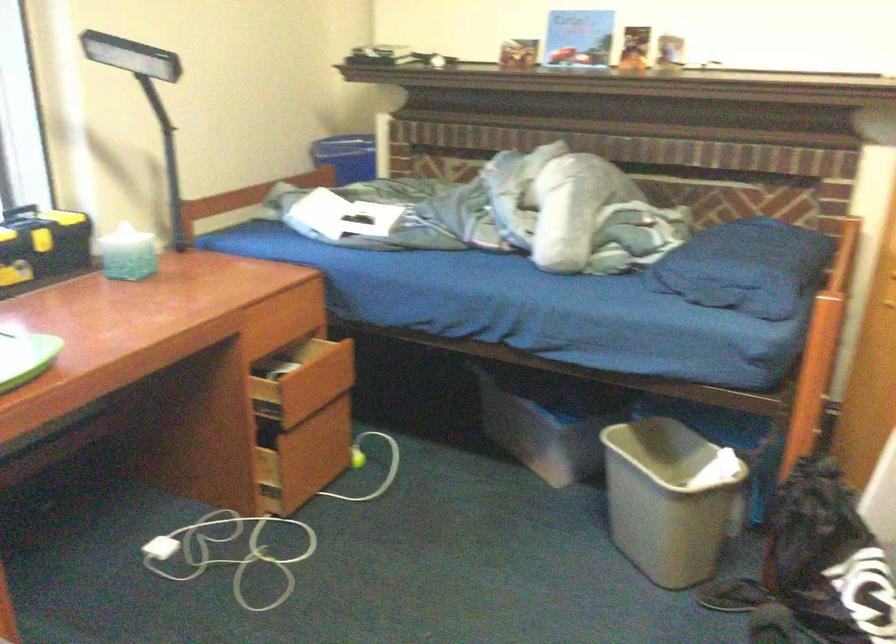
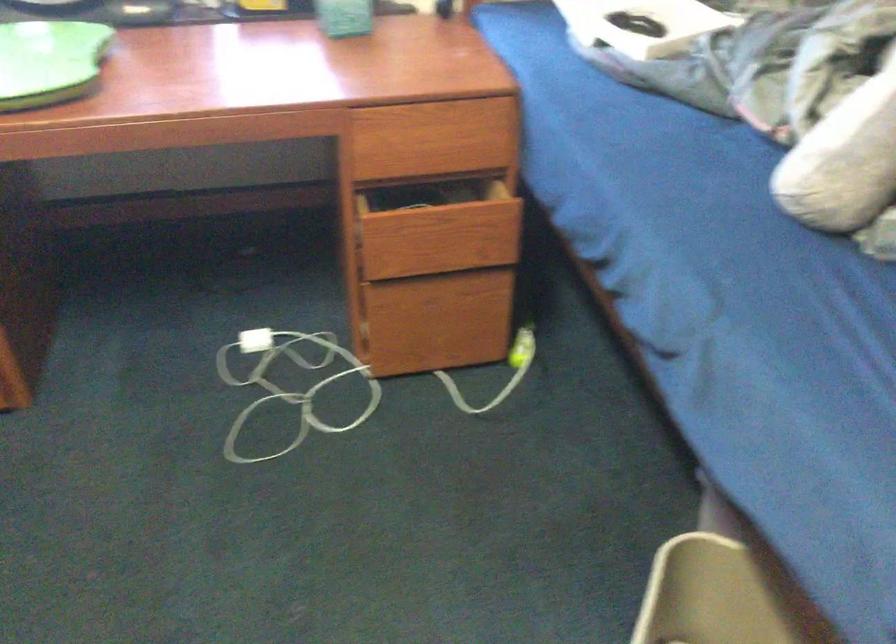
Where in the second image is the point corresponding to (316,455) from the first image?

(455, 321)